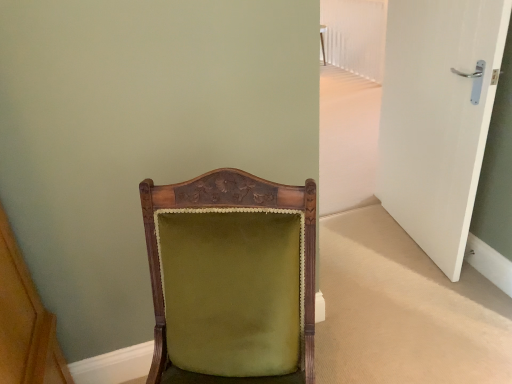
I want to click on velvet green chair at center, so click(231, 279).

This screenshot has height=384, width=512. What do you see at coordinates (231, 279) in the screenshot?
I see `velvet green chair at center` at bounding box center [231, 279].

Based on the photo, what is the approximate height of velvet green chair at center?

velvet green chair at center is 36.46 inches in height.

Measure the distance between white glossy door at right and camera.

white glossy door at right is 1.46 meters away from camera.

Image resolution: width=512 pixels, height=384 pixels. In order to click on white glossy door at right in this screenshot , I will do `click(438, 117)`.

Describe the element at coordinates (438, 117) in the screenshot. I see `white glossy door at right` at that location.

Locate an element on the screen. The image size is (512, 384). velvet green chair at center is located at coordinates (231, 279).

Does velvet green chair at center appear on the left side of white glossy door at right?

Correct, you'll find velvet green chair at center to the left of white glossy door at right.

Is velvet green chair at center in front of or behind white glossy door at right in the image?

velvet green chair at center is positioned closer to the viewer than white glossy door at right.

Between point (151, 278) and point (448, 95), which one is positioned in front?

The point (151, 278) is closer.

From the image's perspective, is velvet green chair at center above or below white glossy door at right?

From the image's perspective, velvet green chair at center appears below white glossy door at right.

From a real-world perspective, between velvet green chair at center and white glossy door at right, who is vertically lower?

velvet green chair at center, from a real-world perspective.

Considering the sizes of objects velvet green chair at center and white glossy door at right in the image provided, who is thinner, velvet green chair at center or white glossy door at right?

Thinner between the two is white glossy door at right.

Considering the relative sizes of velvet green chair at center and white glossy door at right in the image provided, is velvet green chair at center shorter than white glossy door at right?

Correct, velvet green chair at center is not as tall as white glossy door at right.

Is velvet green chair at center smaller than white glossy door at right?

No, velvet green chair at center is not smaller than white glossy door at right.

Based on the photo, would you say velvet green chair at center contains white glossy door at right?

No, white glossy door at right is not surrounded by velvet green chair at center.

Is velvet green chair at center directly adjacent to white glossy door at right?

No, velvet green chair at center is not making contact with white glossy door at right.

Could you tell me if velvet green chair at center is turned towards white glossy door at right?

No.

Can you tell me how much velvet green chair at center and white glossy door at right differ in facing direction?

velvet green chair at center and white glossy door at right are facing 69.2 degrees away from each other.

How far apart are velvet green chair at center and white glossy door at right?

velvet green chair at center and white glossy door at right are 3.93 feet apart.

Where is `chair in front of the white glossy door at right`? chair in front of the white glossy door at right is located at coordinates (231, 279).

Visually, is white glossy door at right positioned to the left or to the right of velvet green chair at center?

Based on their positions, white glossy door at right is located to the right of velvet green chair at center.

Which object is further away from the camera, white glossy door at right or velvet green chair at center?

white glossy door at right.

Does point (422, 209) come farther from viewer compared to point (148, 201)?

Yes, point (422, 209) is farther from viewer.

From the image's perspective, relative to velvet green chair at center, is white glossy door at right above or below?

Clearly, from the image's perspective, white glossy door at right is above velvet green chair at center.

From a real-world perspective, is white glossy door at right physically located above or below velvet green chair at center?

white glossy door at right is above velvet green chair at center.

In terms of width, does white glossy door at right look wider or thinner when compared to velvet green chair at center?

Considering their sizes, white glossy door at right looks slimmer than velvet green chair at center.

From their relative heights in the image, would you say white glossy door at right is taller or shorter than velvet green chair at center?

In the image, white glossy door at right appears to be taller than velvet green chair at center.

Considering the relative sizes of white glossy door at right and velvet green chair at center in the image provided, is white glossy door at right smaller than velvet green chair at center?

Yes, white glossy door at right is smaller than velvet green chair at center.

Is velvet green chair at center inside white glossy door at right?

No, velvet green chair at center is not surrounded by white glossy door at right.

Is white glossy door at right not close to velvet green chair at center?

Absolutely, white glossy door at right is distant from velvet green chair at center.

Could you tell me if white glossy door at right is facing velvet green chair at center?

No, white glossy door at right is not facing towards velvet green chair at center.

How many degrees apart are the facing directions of white glossy door at right and velvet green chair at center?

The angular difference between white glossy door at right and velvet green chair at center is 69.2 degrees.

At what (x,y) coordinates should I click in order to perform the action: click on door above the velvet green chair at center (from the image's perspective). Please return your answer as a coordinate pair (x, y). This screenshot has width=512, height=384. Looking at the image, I should click on (438, 117).

The width and height of the screenshot is (512, 384). Find the location of `chair that is under the white glossy door at right (from a real-world perspective)`. chair that is under the white glossy door at right (from a real-world perspective) is located at coordinates (231, 279).

This screenshot has height=384, width=512. Identify the location of door above the velvet green chair at center (from a real-world perspective). (438, 117).